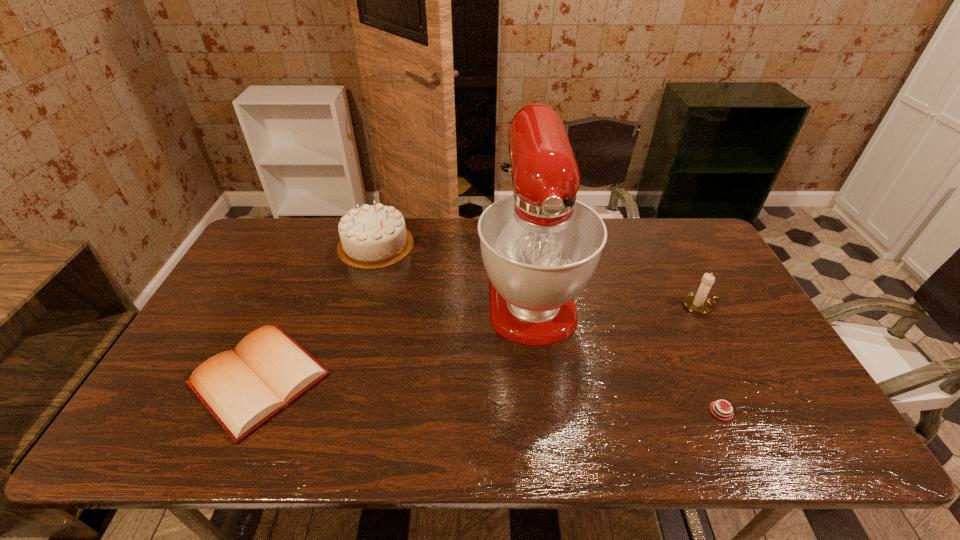
This screenshot has width=960, height=540. Find the location of `free space at the far edge of the desktop`. free space at the far edge of the desktop is located at coordinates (621, 221).

This screenshot has height=540, width=960. What are the coordinates of `vacant space at the left edge of the desktop` in the screenshot? It's located at (251, 265).

The width and height of the screenshot is (960, 540). Find the location of `vacant region at the right edge of the desktop`. vacant region at the right edge of the desktop is located at coordinates (746, 361).

The image size is (960, 540). In the image, there is a desktop. Identify the location of blank space at the far left corner. pos(264,230).

I want to click on free space at the near left corner, so click(x=150, y=436).

The image size is (960, 540). What are the coordinates of `vacant region at the far right corner of the desktop` in the screenshot? It's located at (707, 242).

This screenshot has width=960, height=540. In the image, there is a desktop. Find the location of `vacant space at the near right corner`. vacant space at the near right corner is located at coordinates (775, 453).

You are a GUI agent. You are given a task and a screenshot of the screen. Output one action in this format:
    pyautogui.click(x=<x>, y=<y>)
    Task: Click on the free space between the mixer and the Bible
    The image size is (960, 540).
    Given the screenshot: What is the action you would take?
    pyautogui.click(x=395, y=333)

You are a GUI agent. You are given a task and a screenshot of the screen. Output one action in this format:
    pyautogui.click(x=<x>, y=<y>)
    Task: Click on the unoccupied area between the birthday cake and the tallest object
    This screenshot has height=540, width=960.
    Given the screenshot: What is the action you would take?
    pyautogui.click(x=453, y=266)

This screenshot has width=960, height=540. I want to click on empty space that is in between the shortest object and the mixer, so click(x=626, y=349).